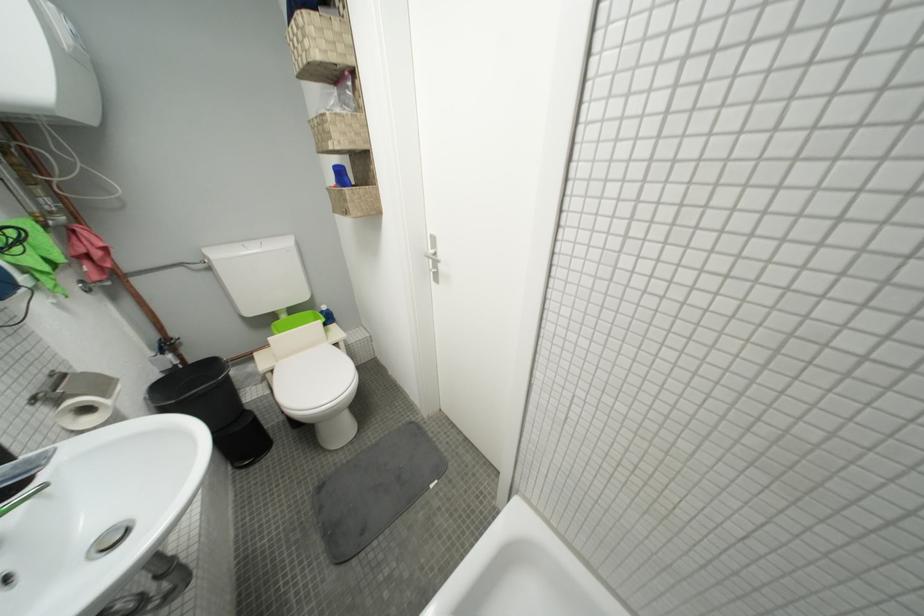
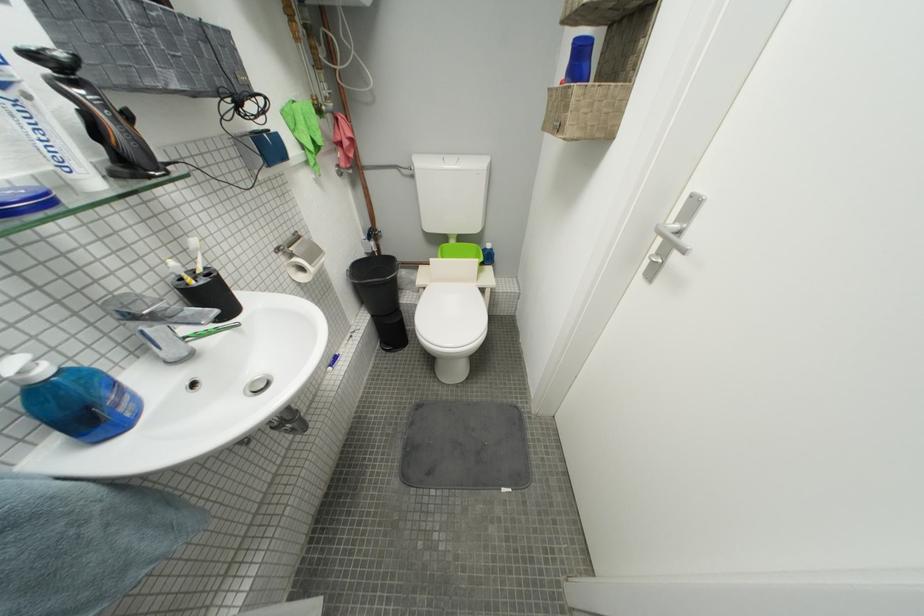
Based on the continuous images, in which direction is the camera rotating?

The camera rotated toward left-down.